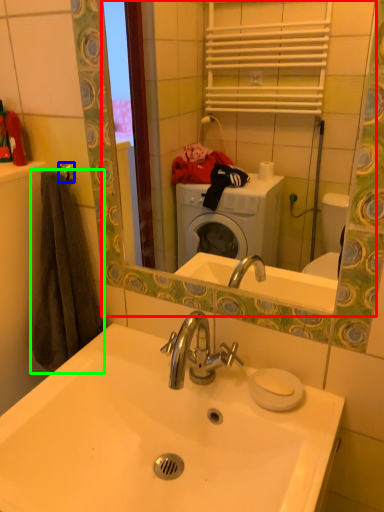
Question: Estimate the real-world distances between objects in this image. Which object is closer to mirror (highlighted by a red box), towel bar (highlighted by a blue box) or bath towel (highlighted by a green box)?

Choices:
 (A) towel bar
 (B) bath towel

Answer: (B)